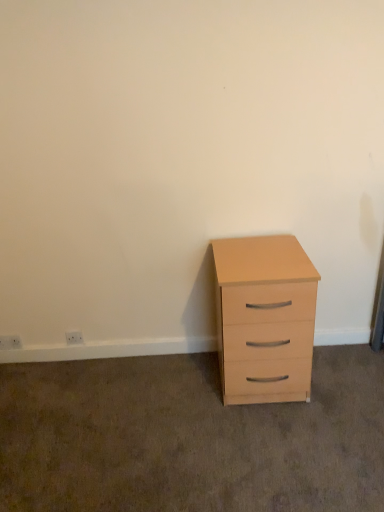
Question: Is the depth of white plastic electric outlet at lower left, which is the 2th electric outlet from left to right, greater than that of white plastic electric outlet at lower left, positioned as the second electric outlet in right-to-left order?

Choices:
 (A) yes
 (B) no

Answer: (B)

Question: From the image's perspective, would you say white plastic electric outlet at lower left, the 1th electric outlet viewed from the right, is positioned over white plastic electric outlet at lower left, positioned as the second electric outlet in right-to-left order?

Choices:
 (A) no
 (B) yes

Answer: (B)

Question: Is white plastic electric outlet at lower left, the 1th electric outlet viewed from the right, oriented towards white plastic electric outlet at lower left, positioned as the second electric outlet in right-to-left order?

Choices:
 (A) no
 (B) yes

Answer: (A)

Question: Considering the relative sizes of white plastic electric outlet at lower left, which is the 2th electric outlet from left to right, and white plastic electric outlet at lower left, positioned as the second electric outlet in right-to-left order, in the image provided, is white plastic electric outlet at lower left, which is the 2th electric outlet from left to right, shorter than white plastic electric outlet at lower left, positioned as the second electric outlet in right-to-left order,?

Choices:
 (A) yes
 (B) no

Answer: (A)

Question: Considering the relative sizes of white plastic electric outlet at lower left, the 1th electric outlet viewed from the right, and white plastic electric outlet at lower left, marked as the 1th electric outlet in a left-to-right arrangement, in the image provided, is white plastic electric outlet at lower left, the 1th electric outlet viewed from the right, taller than white plastic electric outlet at lower left, marked as the 1th electric outlet in a left-to-right arrangement,?

Choices:
 (A) no
 (B) yes

Answer: (A)

Question: Relative to white plastic electric outlet at lower left, positioned as the second electric outlet in right-to-left order, is light wood chest of drawers at right in front or behind?

Choices:
 (A) front
 (B) behind

Answer: (A)

Question: Does point (281, 352) appear closer or farther from the camera than point (4, 344)?

Choices:
 (A) closer
 (B) farther

Answer: (A)

Question: From a real-world perspective, is light wood chest of drawers at right physically located above or below white plastic electric outlet at lower left, marked as the 1th electric outlet in a left-to-right arrangement?

Choices:
 (A) above
 (B) below

Answer: (A)

Question: Is light wood chest of drawers at right wider or thinner than white plastic electric outlet at lower left, marked as the 1th electric outlet in a left-to-right arrangement?

Choices:
 (A) wide
 (B) thin

Answer: (A)

Question: From a real-world perspective, is light wood chest of drawers at right physically located above or below white plastic electric outlet at lower left, the 1th electric outlet viewed from the right?

Choices:
 (A) above
 (B) below

Answer: (A)

Question: Based on their sizes in the image, would you say light wood chest of drawers at right is bigger or smaller than white plastic electric outlet at lower left, the 1th electric outlet viewed from the right?

Choices:
 (A) small
 (B) big

Answer: (B)

Question: Considering the positions of point (223, 242) and point (72, 333), is point (223, 242) closer or farther from the camera than point (72, 333)?

Choices:
 (A) closer
 (B) farther

Answer: (A)

Question: Considering the relative positions of light wood chest of drawers at right and white plastic electric outlet at lower left, which is the 2th electric outlet from left to right, in the image provided, is light wood chest of drawers at right to the left or to the right of white plastic electric outlet at lower left, which is the 2th electric outlet from left to right,?

Choices:
 (A) right
 (B) left

Answer: (A)

Question: Relative to light wood chest of drawers at right, is white plastic electric outlet at lower left, positioned as the second electric outlet in right-to-left order, in front or behind?

Choices:
 (A) front
 (B) behind

Answer: (B)

Question: In the image, is white plastic electric outlet at lower left, marked as the 1th electric outlet in a left-to-right arrangement, on the left side or the right side of light wood chest of drawers at right?

Choices:
 (A) right
 (B) left

Answer: (B)